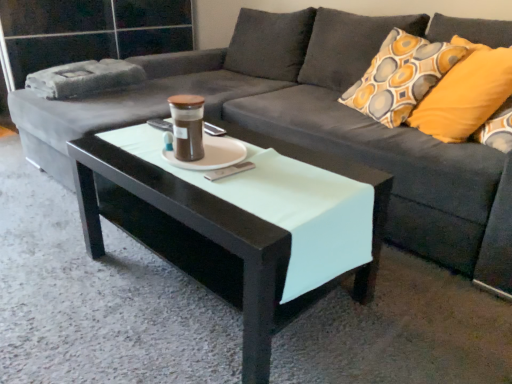
Question: Is black glossy coffee table at center not near transparent glass door at upper left?

Choices:
 (A) no
 (B) yes

Answer: (B)

Question: Is black glossy coffee table at center positioned with its back to transparent glass door at upper left?

Choices:
 (A) no
 (B) yes

Answer: (A)

Question: From the image's perspective, is black glossy coffee table at center on transparent glass door at upper left?

Choices:
 (A) yes
 (B) no

Answer: (B)

Question: From the image's perspective, is black glossy coffee table at center beneath transparent glass door at upper left?

Choices:
 (A) no
 (B) yes

Answer: (B)

Question: Does black glossy coffee table at center appear on the left side of transparent glass door at upper left?

Choices:
 (A) no
 (B) yes

Answer: (A)

Question: From a real-world perspective, is brown glass jar at center physically located above or below transparent glass door at upper left?

Choices:
 (A) above
 (B) below

Answer: (A)

Question: Does point 202,155 appear closer or farther from the camera than point 16,41?

Choices:
 (A) closer
 (B) farther

Answer: (A)

Question: Relative to transparent glass door at upper left, is brown glass jar at center in front or behind?

Choices:
 (A) behind
 (B) front

Answer: (B)

Question: Is brown glass jar at center to the left or to the right of transparent glass door at upper left in the image?

Choices:
 (A) left
 (B) right

Answer: (B)

Question: From a real-world perspective, is transparent glass door at upper left physically located above or below black glossy coffee table at center?

Choices:
 (A) above
 (B) below

Answer: (A)

Question: From the image's perspective, is transparent glass door at upper left above or below black glossy coffee table at center?

Choices:
 (A) above
 (B) below

Answer: (A)

Question: From their relative heights in the image, would you say transparent glass door at upper left is taller or shorter than black glossy coffee table at center?

Choices:
 (A) tall
 (B) short

Answer: (A)

Question: Considering the positions of transparent glass door at upper left and black glossy coffee table at center in the image, is transparent glass door at upper left bigger or smaller than black glossy coffee table at center?

Choices:
 (A) small
 (B) big

Answer: (B)

Question: From their relative heights in the image, would you say transparent glass door at upper left is taller or shorter than yellow fabric pillow at right?

Choices:
 (A) short
 (B) tall

Answer: (B)

Question: Based on their sizes in the image, would you say transparent glass door at upper left is bigger or smaller than yellow fabric pillow at right?

Choices:
 (A) big
 (B) small

Answer: (A)